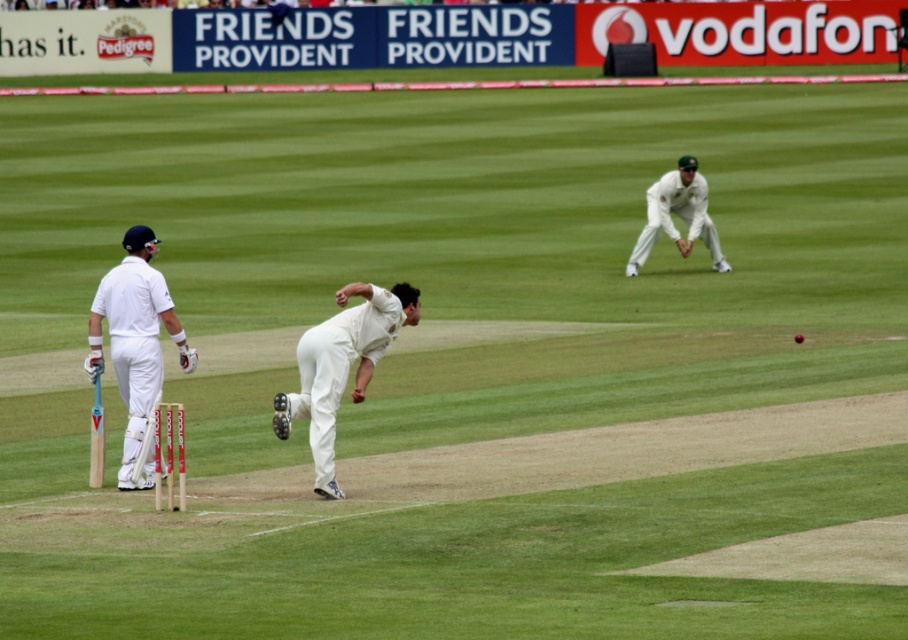
You are a new cricket player standing at the crease with the white matte cricket bat at left in your hand. You want to throw the white cloth glove at upper right to your teammate 10 meters away. Can you accurately throw the glove from the bat to your teammate?

The distance between the white matte cricket bat at left and white cloth glove at upper right is 10.76 meters. Since your teammate is only 10 meters away, you can throw the glove to them as the distance is slightly shorter than the 10.76 meters between the bat and the glove.

You are a spectator at the cricket match and want to know the position of the white matte cricket bat at left relative to the white cloth glove at upper right. Can you describe where the bat is in relation to the glove?

The white matte cricket bat at left is located below the white cloth glove at upper right.